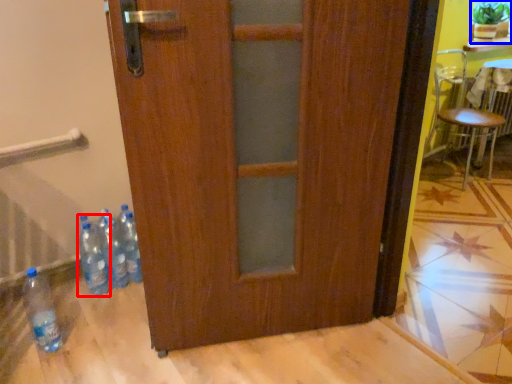
Question: Among these objects, which one is nearest to the camera, bottle (highlighted by a red box) or houseplant (highlighted by a blue box)?

Choices:
 (A) bottle
 (B) houseplant

Answer: (A)